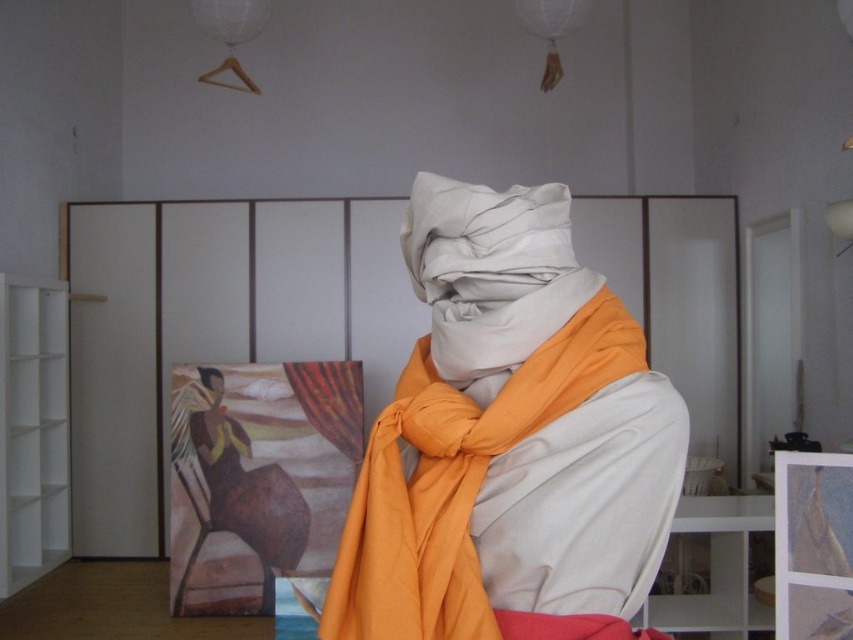
Question: Which of the following is the closest to the observer?

Choices:
 (A) (204, 372)
 (B) (418, 401)

Answer: (B)

Question: Which point is closer to the camera?

Choices:
 (A) (218, 378)
 (B) (518, 195)

Answer: (B)

Question: Which point is farther to the camera?

Choices:
 (A) (222, 396)
 (B) (508, 225)

Answer: (A)

Question: Does matte white scarf at center have a lesser width compared to matte orange scarf at center?

Choices:
 (A) yes
 (B) no

Answer: (B)

Question: Does matte white scarf at center lie in front of matte orange scarf at center?

Choices:
 (A) yes
 (B) no

Answer: (A)

Question: Where is matte white scarf at center located in relation to matte orange scarf at center in the image?

Choices:
 (A) below
 (B) above

Answer: (B)